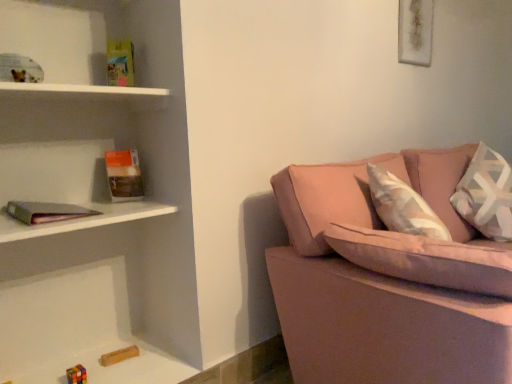
Measure the distance between hardcover book at left and camera.

hardcover book at left is 1.82 meters away from camera.

I want to click on matte gray bookshelf at left, so click(x=83, y=220).

Is pink fabric couch at right bigger or smaller than hardcover book at left?

pink fabric couch at right is bigger than hardcover book at left.

From a real-world perspective, is pink fabric couch at right physically located above or below hardcover book at left?

pink fabric couch at right is below hardcover book at left.

Considering the positions of points (366, 340) and (112, 175), is point (366, 340) closer to camera compared to point (112, 175)?

Yes.

Based on their positions, is pink fabric couch at right located to the left or right of hardcover book at left?

pink fabric couch at right is to the right of hardcover book at left.

Is hardcover book at left placed right next to pink fabric couch at right?

No, hardcover book at left is not next to pink fabric couch at right.

Considering the relative sizes of hardcover book at left and pink fabric couch at right in the image provided, is hardcover book at left bigger than pink fabric couch at right?

No.

Could you tell me if hardcover book at left is turned towards pink fabric couch at right?

No, hardcover book at left is not turned towards pink fabric couch at right.

Which of these two, pink fabric couch at right or matte gray bookshelf at left, is bigger?

Bigger between the two is pink fabric couch at right.

Is pink fabric couch at right further to camera compared to matte gray bookshelf at left?

No, pink fabric couch at right is in front of matte gray bookshelf at left.

Locate an element on the screen. The height and width of the screenshot is (384, 512). studio couch below the matte gray bookshelf at left (from the image's perspective) is located at coordinates (388, 280).

Considering the relative sizes of white textured pillow at right and hardcover book at left in the image provided, is white textured pillow at right shorter than hardcover book at left?

In fact, white textured pillow at right may be taller than hardcover book at left.

Are white textured pillow at right and hardcover book at left located far from each other?

white textured pillow at right is far away from hardcover book at left.

Can you tell me how much white textured pillow at right and hardcover book at left differ in facing direction?

The angle between the facing direction of white textured pillow at right and the facing direction of hardcover book at left is 6.55 degrees.

Considering the positions of point (472, 162) and point (137, 153), is point (472, 162) closer or farther from the camera than point (137, 153)?

Point (472, 162).

Considering the relative sizes of white textured pillow at right and pink fabric couch at right in the image provided, is white textured pillow at right bigger than pink fabric couch at right?

Incorrect, white textured pillow at right is not larger than pink fabric couch at right.

Considering the relative positions of white textured pillow at right and pink fabric couch at right in the image provided, is white textured pillow at right in front of pink fabric couch at right?

That is False.

Is white textured pillow at right aimed at pink fabric couch at right?

Yes, white textured pillow at right is turned towards pink fabric couch at right.

Considering the positions of objects matte gray bookshelf at left and pink fabric couch at right in the image provided, who is more to the left, matte gray bookshelf at left or pink fabric couch at right?

matte gray bookshelf at left is more to the left.

Do you think matte gray bookshelf at left is within pink fabric couch at right, or outside of it?

The correct answer is: outside.

Measure the distance from matte gray bookshelf at left to pink fabric couch at right.

The distance of matte gray bookshelf at left from pink fabric couch at right is 30.19 inches.

The image size is (512, 384). I want to click on pillow that appears behind the matte gray bookshelf at left, so click(486, 195).

From a real-world perspective, does white textured pillow at right stand above matte gray bookshelf at left?

Actually, white textured pillow at right is physically below matte gray bookshelf at left in the real world.

Considering the relative sizes of white textured pillow at right and matte gray bookshelf at left in the image provided, is white textured pillow at right taller than matte gray bookshelf at left?

Correct, white textured pillow at right is much taller as matte gray bookshelf at left.

Which of these two, white textured pillow at right or matte gray bookshelf at left, is smaller?

With smaller size is matte gray bookshelf at left.

Where is `studio couch to the right of hardcover book at left`? studio couch to the right of hardcover book at left is located at coordinates coord(388,280).

Locate an element on the screen. Image resolution: width=512 pixels, height=384 pixels. book behind the pink fabric couch at right is located at coordinates (124, 175).

Looking at the image, which one is located closer to pink fabric couch at right, hardcover book at left or matte gray bookshelf at left?

matte gray bookshelf at left is closer to pink fabric couch at right.

Considering their positions, is white textured pillow at right positioned closer to pink fabric couch at right than matte gray bookshelf at left?

matte gray bookshelf at left.

Looking at the image, which one is located closer to pink fabric couch at right, matte gray bookshelf at left or hardcover book at left?

matte gray bookshelf at left lies closer to pink fabric couch at right than the other object.

When comparing their distances from pink fabric couch at right, does matte gray bookshelf at left or white textured pillow at right seem further?

white textured pillow at right.

Estimate the real-world distances between objects in this image. Which object is closer to hardcover book at left, pink fabric couch at right or matte gray bookshelf at left?

matte gray bookshelf at left lies closer to hardcover book at left than the other object.

Which object lies further to the anchor point matte gray bookshelf at left, hardcover book at left or pink fabric couch at right?

Based on the image, pink fabric couch at right appears to be further to matte gray bookshelf at left.

Based on their spatial positions, is white textured pillow at right or pink fabric couch at right further from matte gray bookshelf at left?

The object further to matte gray bookshelf at left is white textured pillow at right.

Which object lies nearer to the anchor point white textured pillow at right, pink fabric couch at right or hardcover book at left?

Based on the image, pink fabric couch at right appears to be nearer to white textured pillow at right.

In order to click on book between matte gray bookshelf at left and pink fabric couch at right in the horizontal direction in this screenshot , I will do pos(124,175).

The image size is (512, 384). I want to click on studio couch between matte gray bookshelf at left and white textured pillow at right, so click(x=388, y=280).

At what (x,y) coordinates should I click in order to perform the action: click on book between matte gray bookshelf at left and white textured pillow at right from left to right. Please return your answer as a coordinate pair (x, y). Looking at the image, I should click on (124, 175).

What are the coordinates of `studio couch located between hardcover book at left and white textured pillow at right in the left-right direction` in the screenshot? It's located at (388, 280).